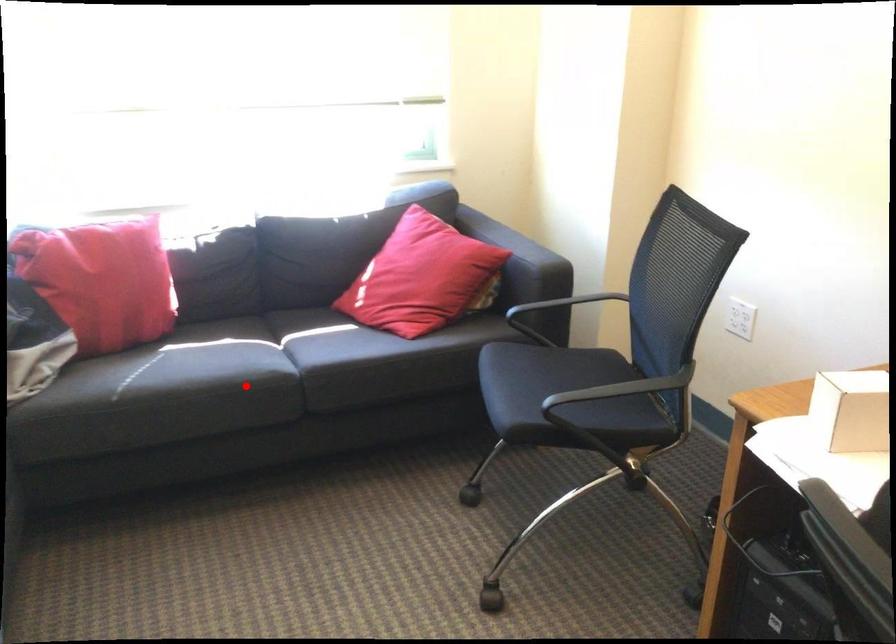
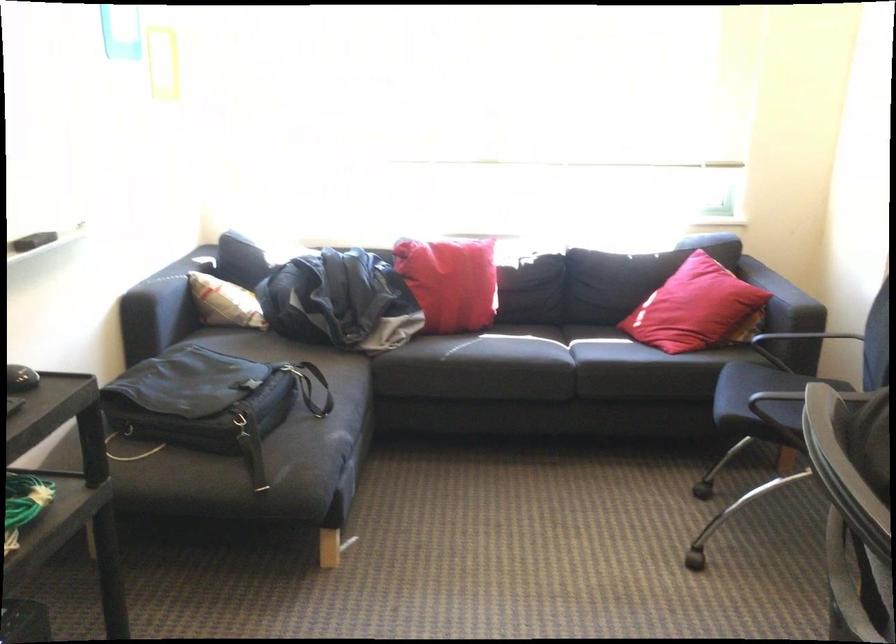
Question: I am providing you with two images of the same scene from different viewpoints. Image1 has a red point marked. In image2, the corresponding 3D location appears at what relative position? Reply with the corresponding letter.

Choices:
 (A) Closer
 (B) Farther

Answer: (B)